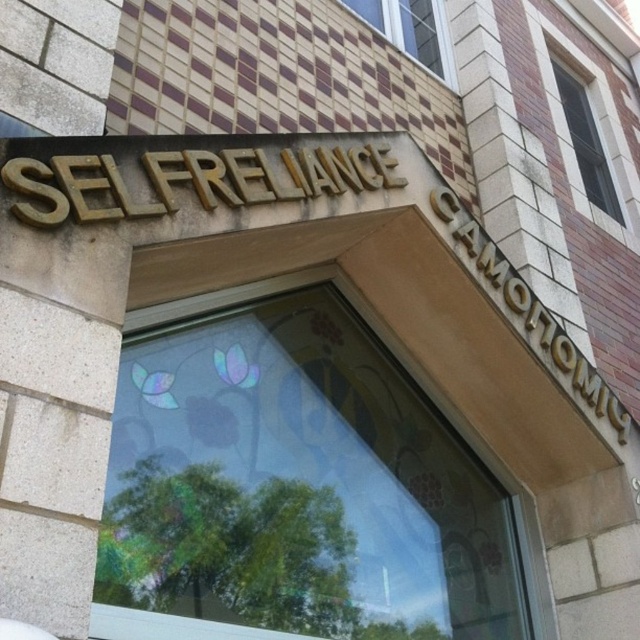
You are standing in front of the building and want to take a photo. You notice two points marked on the building facade. Which point is closer to your camera, point (269, 493) or point (600, 161)?

Point (269, 493) is closer to the camera than point (600, 161).

You are standing in front of the building facade. There is a point at coordinates (301,484). What is located at this point?

At point (301,484) lies transparent stained glass at center.

You are standing in front of the building and want to touch both points on the facade. Which point should you reach for first, the point at coordinate (x=364, y=449) or the point at (x=428, y=44)?

You should reach for the point at coordinate (x=364, y=449) first because it is closer to you than the point at (x=428, y=44).